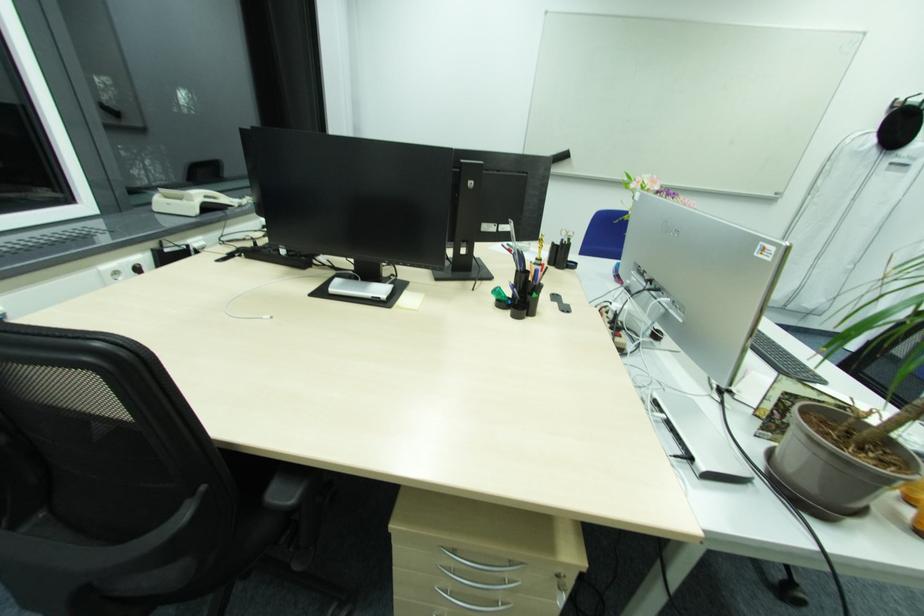
Where is `telephone handset`? telephone handset is located at coordinates (172, 201).